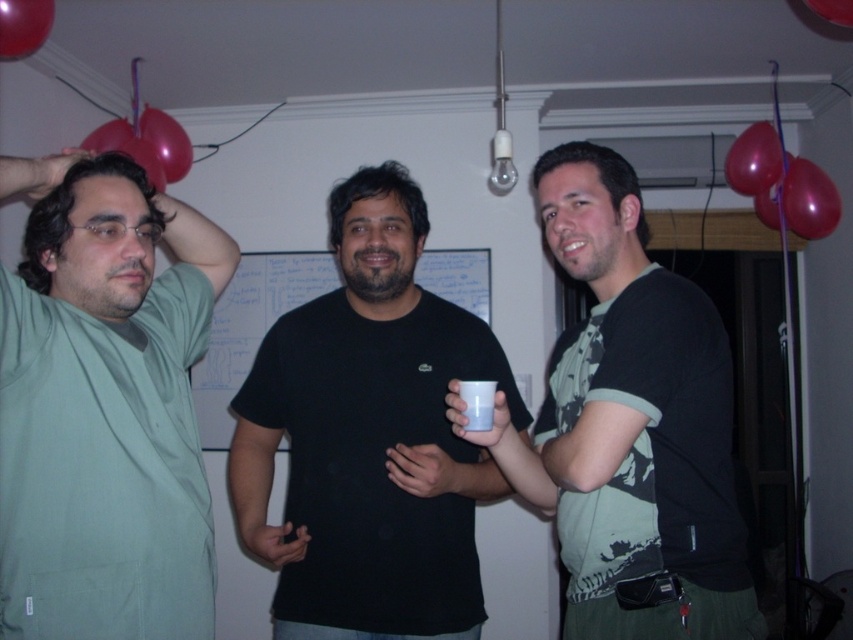
You are standing in the room and want to know how far the point at coordinates (300, 285) is from you. Can you determine the distance?

The point at coordinates (300, 285) is 3.61 meters away from you.

You are a photographer standing at the camera position. You want to capture a photo that includes the red rubber balloon at upper left. What is the minimum distance you need to move forward to ensure the balloon is within the frame?

The red rubber balloon at upper left is 2.60 meters from the camera. To ensure it is within the frame, you need to move forward so that the distance is reduced to within the camera lens range. However, without specific lens details, the minimum distance would be moving forward until the balloon is no longer out of frame, but based on typical framing, moving approximately 0.5 meters closer might help. However, the exact answer requires knowing the camera specifications. Since the problem states the balloon 2

You are standing in the room and want to reach the red rubber balloon at upper left. Which direction should you move to get closer to it?

The red rubber balloon at upper left is located at point (126, 147), so you should move towards the upper left direction to get closer to it.